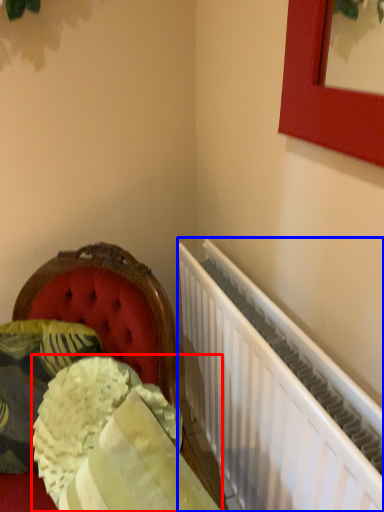
Question: Which object appears closest to the camera in this image, material (highlighted by a red box) or radiator (highlighted by a blue box)?

Choices:
 (A) material
 (B) radiator

Answer: (A)